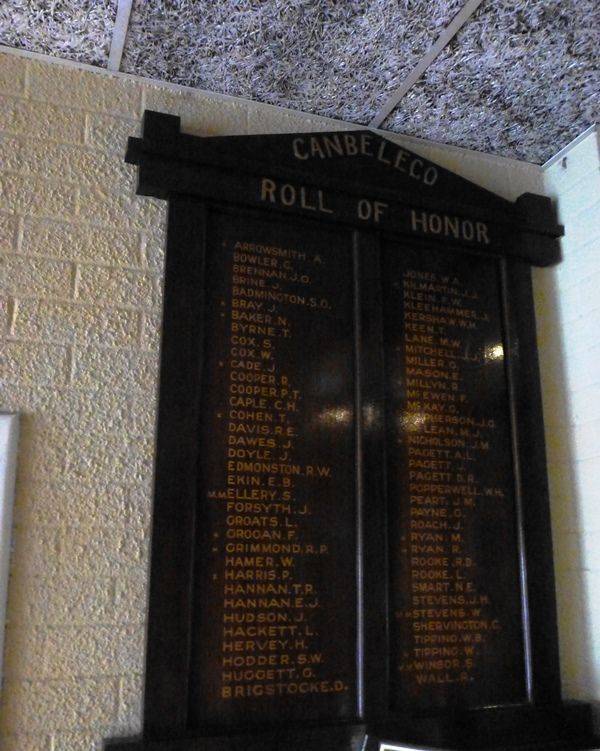
In order to click on brick wall in this screenshot , I will do `click(42, 598)`.